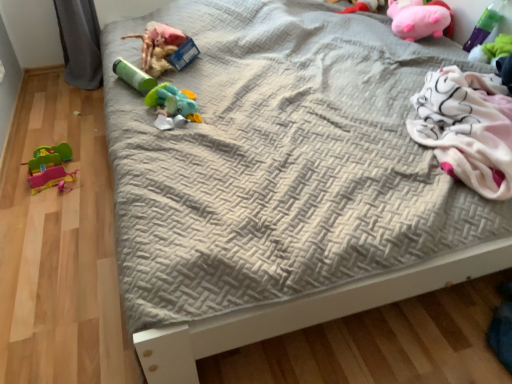
Locate an element on the screen. This screenshot has height=384, width=512. vacant region below rubber duck at left, which is the seventh toy in right-to-left order (from a real-world perspective) is located at coordinates (56, 179).